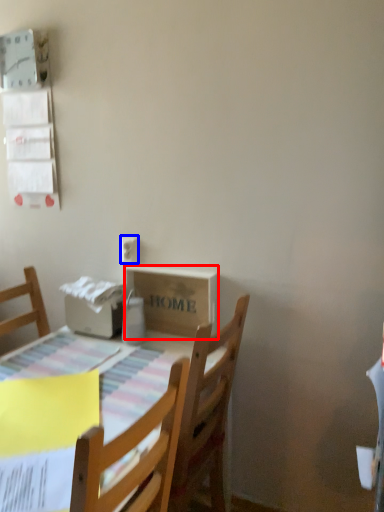
Question: Which of the following is the closest to the observer, cardboard box (highlighted by a red box) or electric outlet (highlighted by a blue box)?

Choices:
 (A) cardboard box
 (B) electric outlet

Answer: (A)